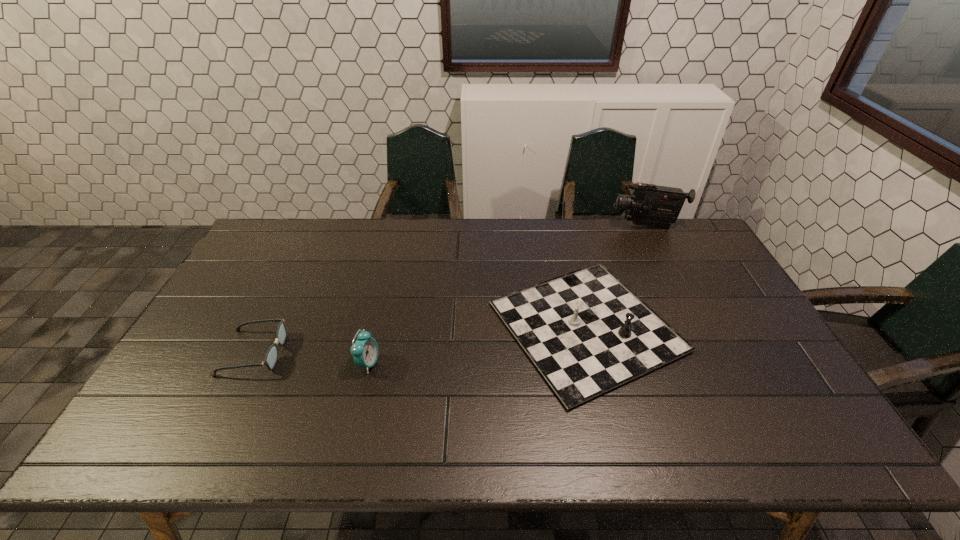
This screenshot has height=540, width=960. Identify the location of camcorder. (649, 205).

Where is `the farthest object`? The width and height of the screenshot is (960, 540). the farthest object is located at coordinates click(x=649, y=205).

The image size is (960, 540). Find the location of `the third object from right to left`. the third object from right to left is located at coordinates (365, 350).

Where is `alarm clock`? This screenshot has width=960, height=540. alarm clock is located at coordinates (365, 350).

The width and height of the screenshot is (960, 540). In order to click on the second shortest object in this screenshot , I will do [x=587, y=333].

At what (x,y) coordinates should I click in order to perform the action: click on spectacles. Please return your answer as a coordinate pair (x, y). Looking at the image, I should click on (271, 357).

You are a GUI agent. You are given a task and a screenshot of the screen. Output one action in this format:
    pyautogui.click(x=<x>, y=<y>)
    Task: Click on the shortest object
    The image size is (960, 540).
    Given the screenshot: What is the action you would take?
    pyautogui.click(x=271, y=357)

The image size is (960, 540). Identify the location of vacant point located on the front-facing side of the tallest object. (582, 226).

At what (x,y) coordinates should I click in order to perform the action: click on vacant area located on the front-facing side of the tallest object. Please return your answer as a coordinate pair (x, y). The width and height of the screenshot is (960, 540). Looking at the image, I should click on (539, 226).

This screenshot has width=960, height=540. In order to click on free spot located 0.310m on the front-facing side of the tallest object in this screenshot , I will do `click(528, 226)`.